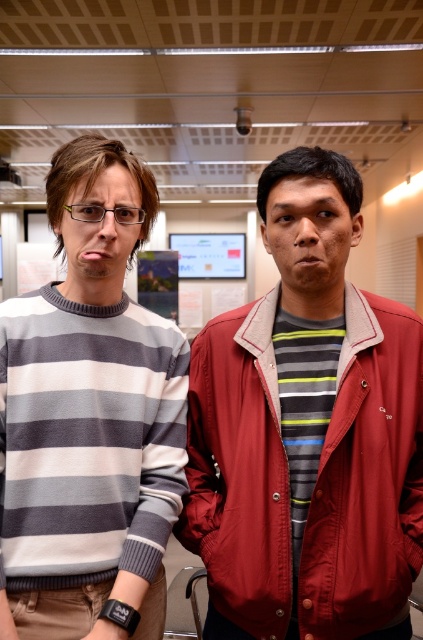
Is point (414, 516) more distant than point (148, 170)?

That is False.

Is matte red jacket at center closer to the viewer compared to striped wool sweater at left?

No, matte red jacket at center is further to the viewer.

The width and height of the screenshot is (423, 640). I want to click on matte red jacket at center, so click(307, 432).